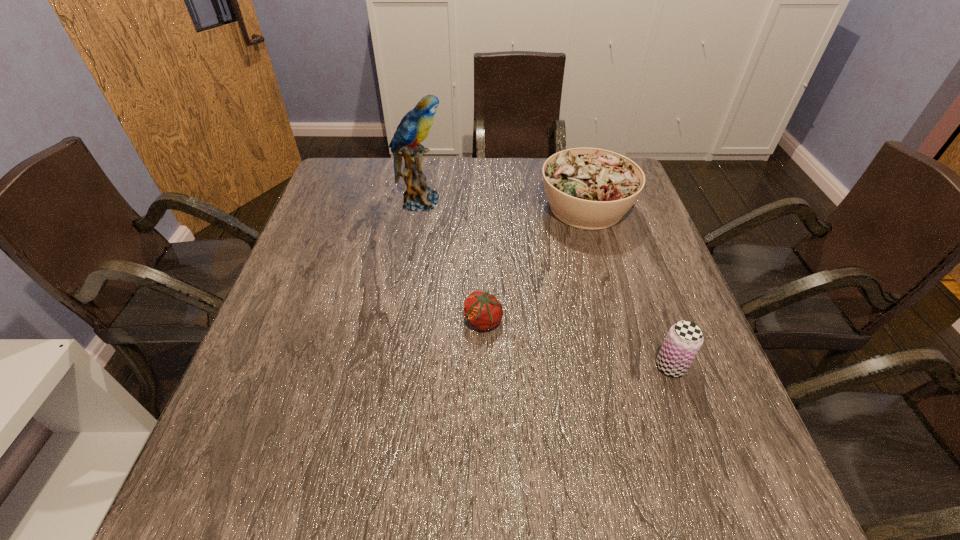
At what (x,y) coordinates should I click in order to perform the action: click on the leftmost object. Please return your answer as a coordinate pair (x, y). Looking at the image, I should click on click(x=414, y=127).

Locate an element on the screen. Image resolution: width=960 pixels, height=540 pixels. parrot is located at coordinates (414, 127).

Identify the location of salad. (587, 188).

I want to click on beer can, so click(684, 339).

You are a GUI agent. You are given a task and a screenshot of the screen. Output one action in this format:
    pyautogui.click(x=<x>, y=<y>)
    Task: Click on the second nearest object
    This screenshot has height=540, width=960.
    Given the screenshot: What is the action you would take?
    pyautogui.click(x=483, y=311)

You are a GUI agent. You are given a task and a screenshot of the screen. Output one action in this format:
    pyautogui.click(x=<x>, y=<y>)
    Task: Click on the second object from left to right
    
    Given the screenshot: What is the action you would take?
    pyautogui.click(x=483, y=311)

This screenshot has height=540, width=960. What are the coordinates of `free space located on the face of the tallest object` in the screenshot? It's located at (533, 201).

This screenshot has width=960, height=540. Identify the location of vacant area situated 0.070m on the left of the salad. [x=515, y=207].

Find the location of a particular element. The image size is (960, 540). vacant region located 0.320m on the left of the nearest object is located at coordinates (495, 366).

Locate an element on the screen. Image resolution: width=960 pixels, height=540 pixels. blank space located on the left of the second nearest object is located at coordinates (353, 321).